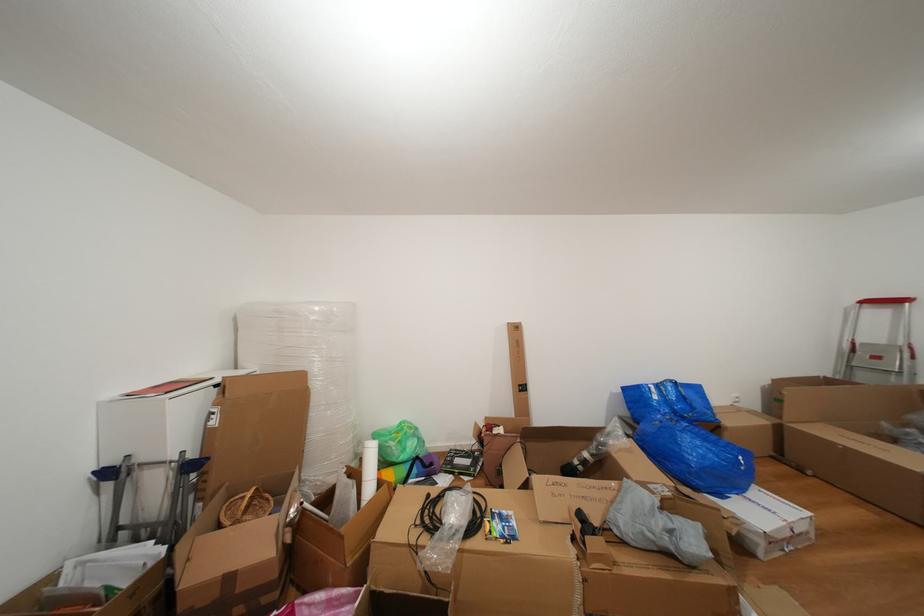
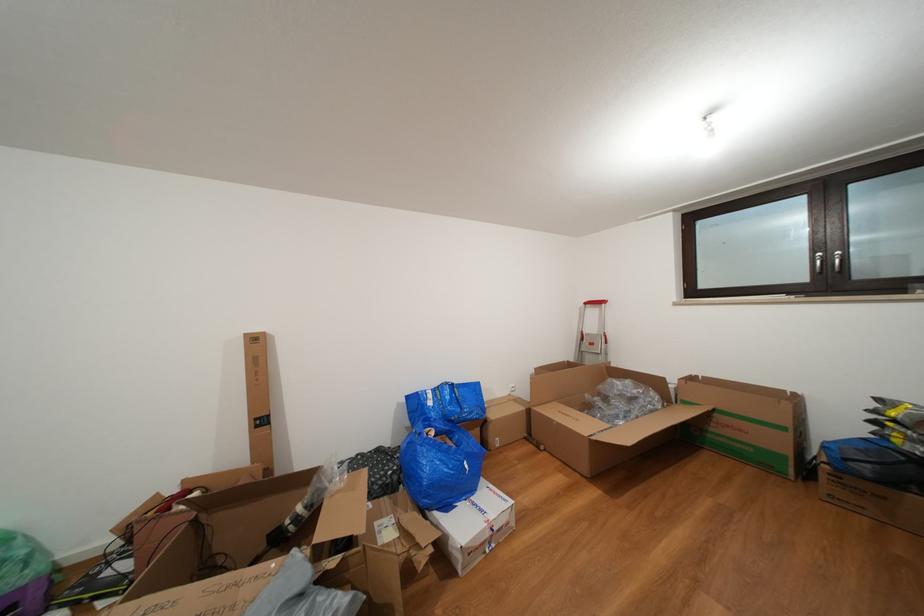
Question: Which direction would the cameraman need to move to produce the second image? Reply with the corresponding letter.

Choices:
 (A) Left
 (B) Right
 (C) Forward
 (D) Backward

Answer: (B)